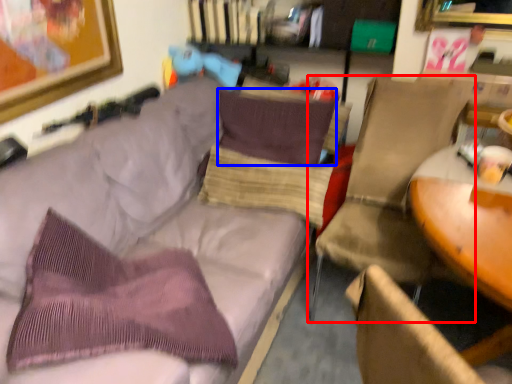
Question: Which of the following is the farthest to the observer, chair (highlighted by a red box) or pillow (highlighted by a blue box)?

Choices:
 (A) chair
 (B) pillow

Answer: (B)